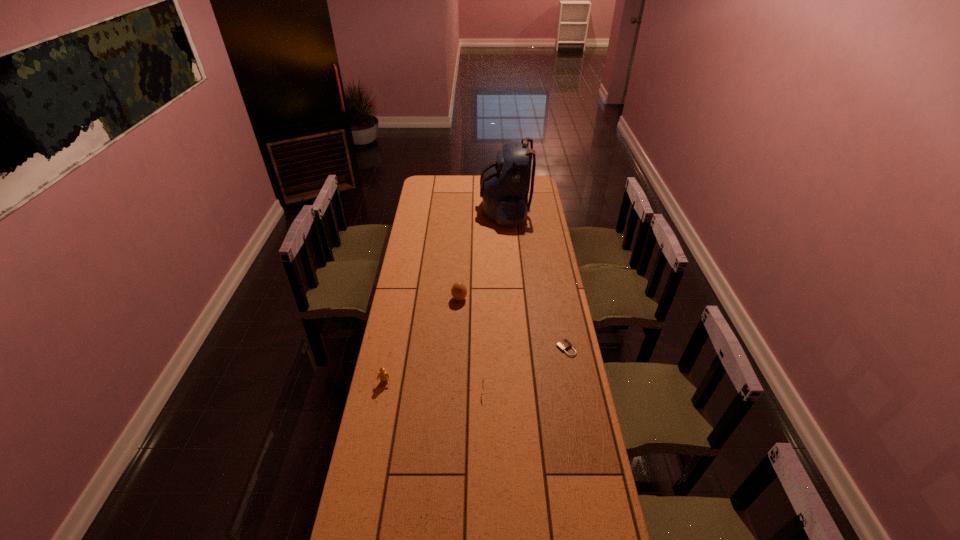
Identify the location of vacant region that satisfies the following two spatial constraints: 1. at the front pocket of the backpack; 2. on the face of the leftmost object. The image size is (960, 540). (518, 382).

Image resolution: width=960 pixels, height=540 pixels. Identify the location of free spot that satisfies the following two spatial constraints: 1. at the front pocket of the farthest object; 2. on the face of the leftmost object. (518, 382).